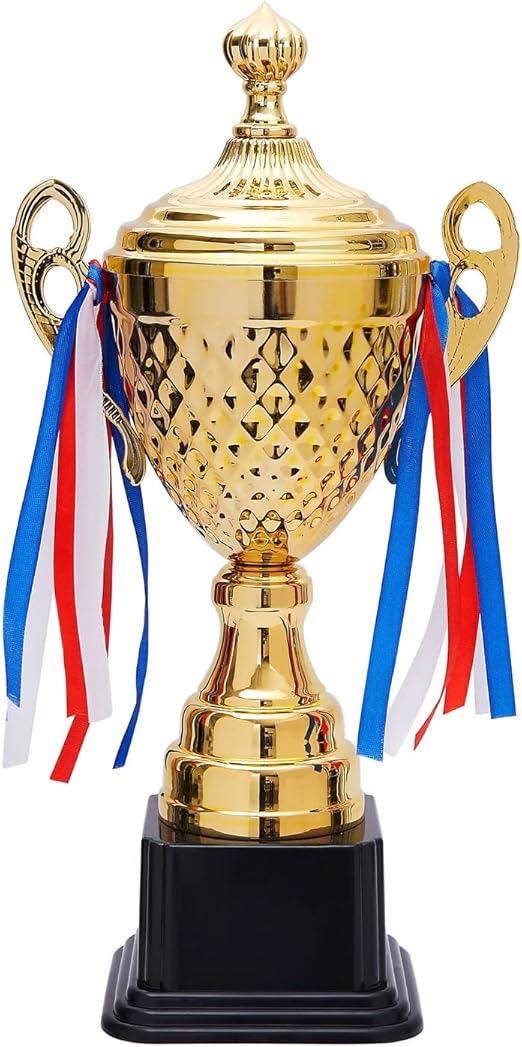
Find the location of a particular element. trophy is located at coordinates (264, 438).